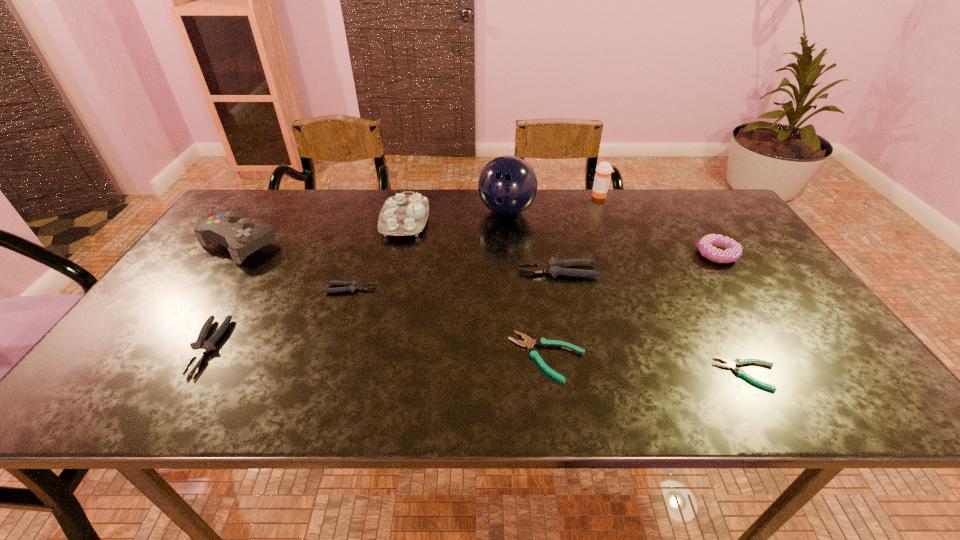
The image size is (960, 540). Identify the location of free space located on the right of the blue chinaware. (503, 220).

This screenshot has width=960, height=540. Find the location of `vacant space located 0.350m on the right of the control`. vacant space located 0.350m on the right of the control is located at coordinates (398, 244).

Locate an element on the screen. Image resolution: width=960 pixels, height=540 pixels. free region located 0.150m on the front of the sixth shortest object is located at coordinates [x=751, y=306].

The width and height of the screenshot is (960, 540). What are the coordinates of `free space located at the gripping part of the sixth tallest object` in the screenshot? It's located at (500, 271).

Locate an element on the screen. free space located at the gripping part of the sixth tallest object is located at coordinates (440, 271).

Locate an element on the screen. The image size is (960, 540). free region located 0.370m at the gripping part of the sixth tallest object is located at coordinates (380, 271).

This screenshot has width=960, height=540. What are the coordinates of `vacant space situated 0.060m at the gripping part of the seventh tallest object` in the screenshot? It's located at (174, 402).

Locate an element on the screen. The width and height of the screenshot is (960, 540). vacant space located 0.080m at the gripping part of the fourth nearest pliers is located at coordinates (407, 288).

Where is `vacant space located 0.110m on the back of the bigger teal pliers`? vacant space located 0.110m on the back of the bigger teal pliers is located at coordinates (539, 299).

This screenshot has height=540, width=960. What are the coordinates of `free space located on the right of the right teal pliers` in the screenshot? It's located at (826, 374).